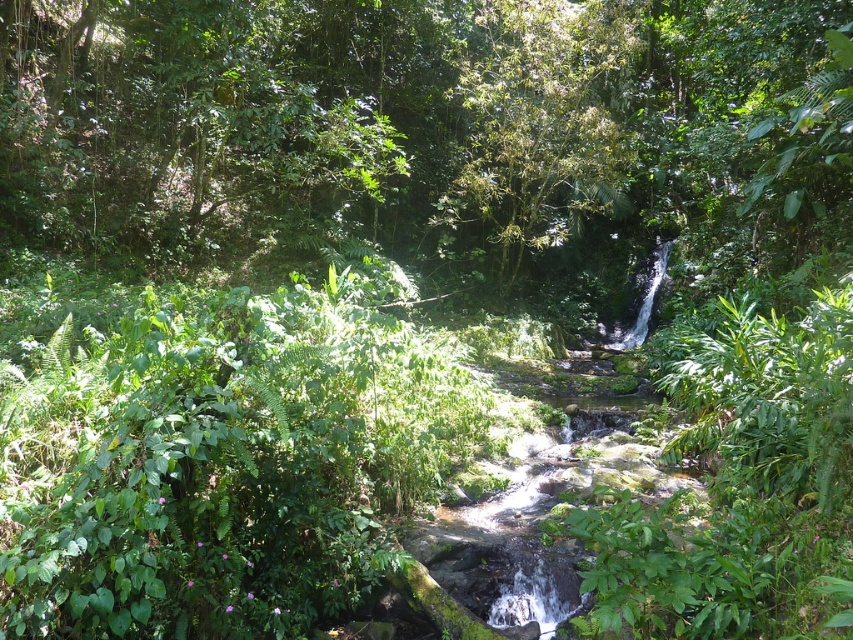
From the picture: Which is above, green leafy tree at center or green leafy tree at upper center?

green leafy tree at upper center is higher up.

Is green leafy tree at center wider than green leafy tree at upper center?

Correct, the width of green leafy tree at center exceeds that of green leafy tree at upper center.

You are a GUI agent. You are given a task and a screenshot of the screen. Output one action in this format:
    pyautogui.click(x=<x>, y=<y>)
    Task: Click on the green leafy tree at center
    The image size is (853, 640).
    Given the screenshot: What is the action you would take?
    pyautogui.click(x=379, y=122)

Where is `green leafy tree at center`? green leafy tree at center is located at coordinates (379, 122).